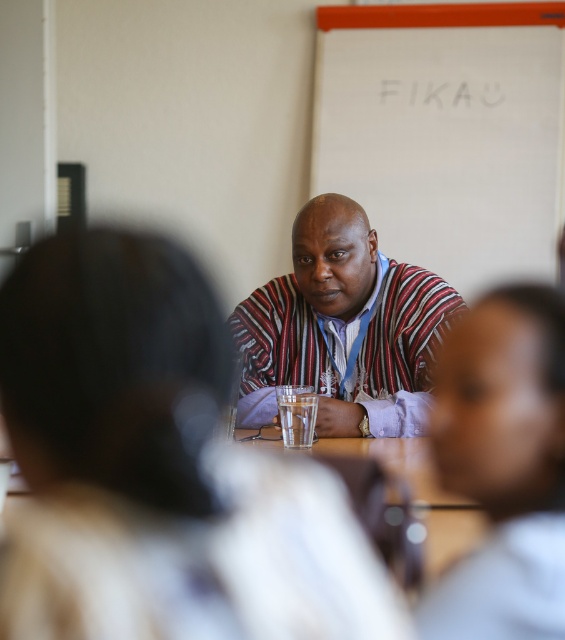
You are standing in the room and want to write something on the whiteboard at upper center. To do this, do you need to walk past the light gray shirt at center?

The whiteboard at upper center is further to the viewer than the light gray shirt at center, so you are already in front of the whiteboard and do not need to walk past the light gray shirt at center.

Based on the photo, in the scene, you see a light gray shirt at center and a striped fabric shirt at center. Which one is more to the right?

The light gray shirt at center is more to the right because it is positioned on the right side of the striped fabric shirt at center.